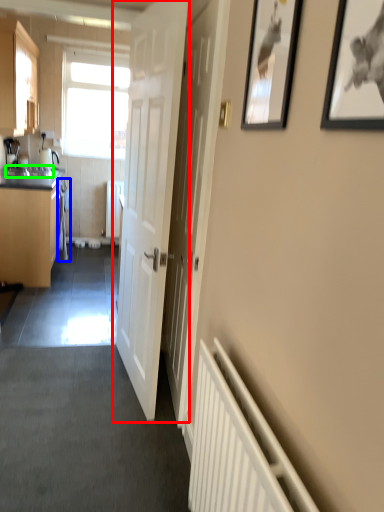
Question: Considering the real-world distances, which object is closest to door (highlighted by a red box)? laundry (highlighted by a blue box) or sink (highlighted by a green box).

Choices:
 (A) laundry
 (B) sink

Answer: (B)